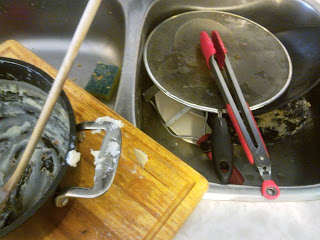
The height and width of the screenshot is (240, 320). I want to click on counter top, so click(241, 222).